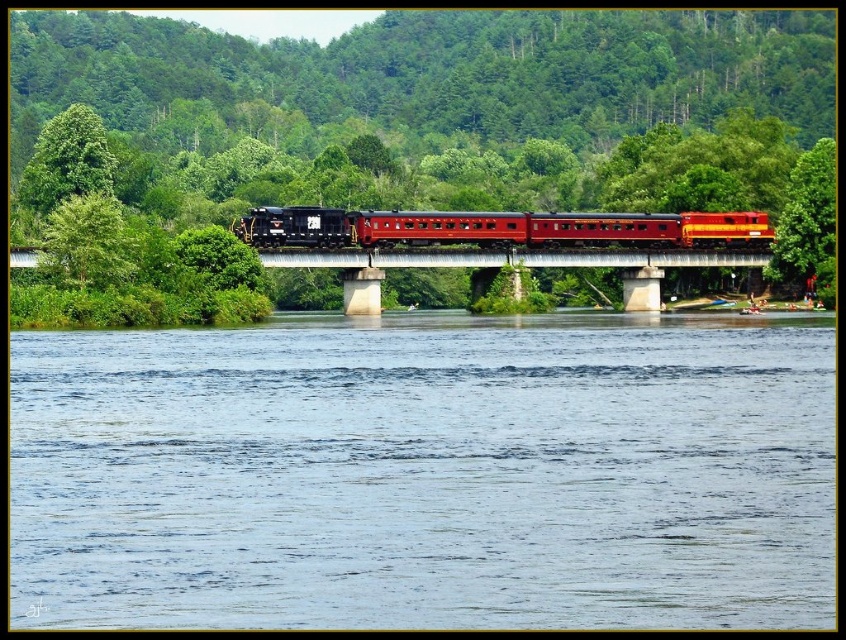
Does point (745, 221) come in front of point (658, 260)?

No, it is behind (658, 260).

Measure the distance between metallic red train at center and concrete bridge at center.

metallic red train at center is 8.06 feet from concrete bridge at center.

Who is more distant from viewer, (733, 212) or (308, 266)?

Point (733, 212)

Locate an element on the screen. Image resolution: width=846 pixels, height=640 pixels. metallic red train at center is located at coordinates (498, 228).

Locate an element on the screen. This screenshot has width=846, height=640. clear blue water at center is located at coordinates (426, 474).

Which is in front, point (212, 413) or point (632, 266)?

Point (212, 413) is in front.

Is point (489, 380) positioned before point (347, 294)?

Yes, point (489, 380) is in front of point (347, 294).

Find the location of a particular element. clear blue water at center is located at coordinates pyautogui.click(x=426, y=474).

Can you confirm if clear blue water at center is bigger than metallic red train at center?

Actually, clear blue water at center might be smaller than metallic red train at center.

Does clear blue water at center have a greater height compared to metallic red train at center?

In fact, clear blue water at center may be shorter than metallic red train at center.

Is point (808, 403) farther from viewer compared to point (684, 241)?

No, (808, 403) is closer to viewer.

What are the coordinates of `clear blue water at center` in the screenshot? It's located at (426, 474).